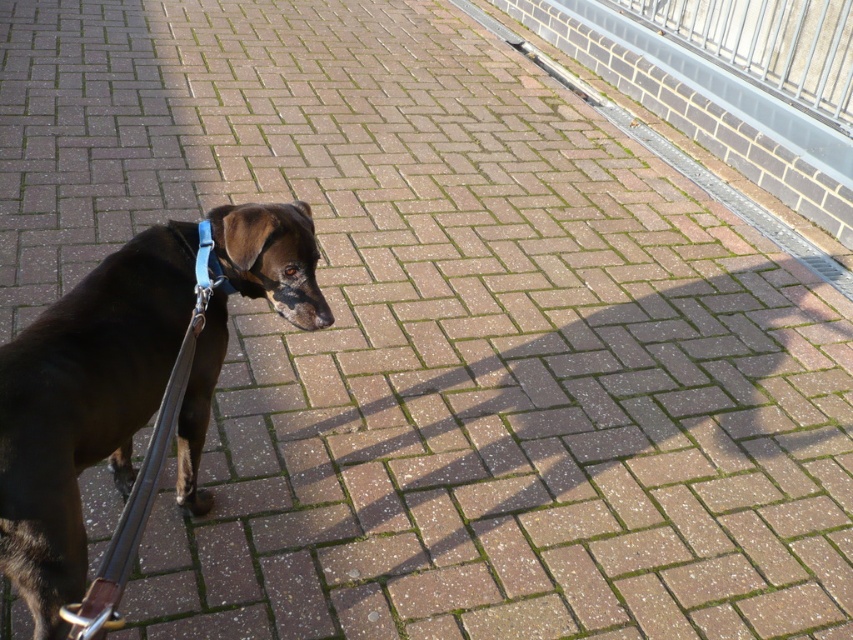
Question: Which of the following is the farthest from the observer?

Choices:
 (A) click(303, 236)
 (B) click(202, 221)

Answer: (B)

Question: Can you confirm if black leather dog at left is positioned to the right of blue fabric strap at center?

Choices:
 (A) no
 (B) yes

Answer: (A)

Question: Is black leather dog at left to the right of blue fabric strap at center from the viewer's perspective?

Choices:
 (A) yes
 (B) no

Answer: (B)

Question: Which of the following is the farthest from the observer?

Choices:
 (A) blue fabric strap at center
 (B) black leather dog at left

Answer: (A)

Question: Which of the following is the farthest from the observer?

Choices:
 (A) black leather dog at left
 (B) blue fabric strap at center

Answer: (B)

Question: Is black leather dog at left to the left of blue fabric strap at center from the viewer's perspective?

Choices:
 (A) yes
 (B) no

Answer: (A)